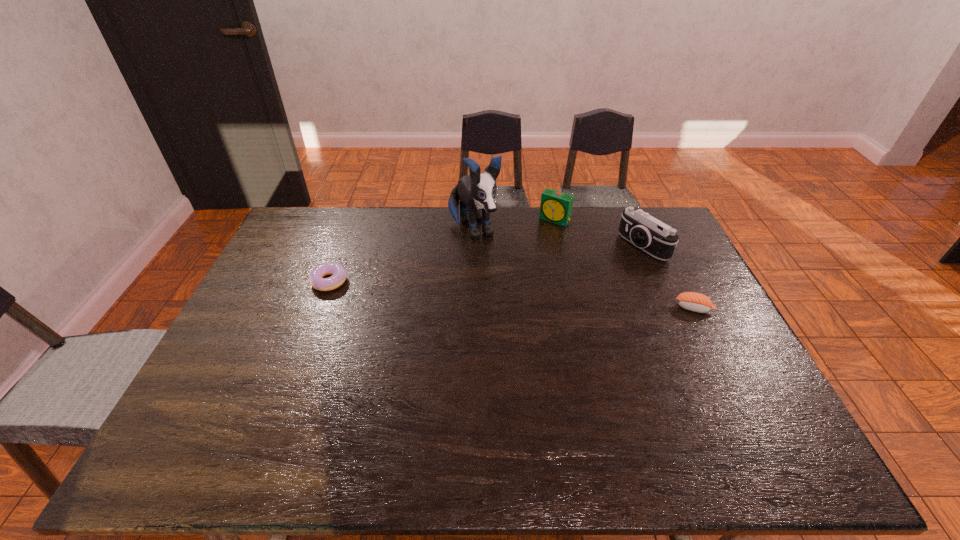
Locate an element on the screen. Image resolution: width=960 pixels, height=540 pixels. vacant space situated on the left of the sushi is located at coordinates (571, 308).

The image size is (960, 540). Find the location of `free space located on the front-facing side of the puppy`. free space located on the front-facing side of the puppy is located at coordinates (521, 323).

Locate an element on the screen. This screenshot has width=960, height=540. free space located 0.070m on the front-facing side of the puppy is located at coordinates (489, 265).

Image resolution: width=960 pixels, height=540 pixels. I want to click on free space located on the front-facing side of the puppy, so click(502, 289).

Locate an element on the screen. vacant area situated on the front lens of the camera is located at coordinates (592, 277).

Locate an element on the screen. This screenshot has height=540, width=960. vacant space situated on the front lens of the camera is located at coordinates (563, 293).

The height and width of the screenshot is (540, 960). What are the coordinates of `vacant position located 0.270m on the front lens of the camera` in the screenshot? It's located at (571, 288).

Locate an element on the screen. free region located on the front-facing side of the third object from left to right is located at coordinates (504, 279).

This screenshot has width=960, height=540. I want to click on vacant space situated on the front-facing side of the third object from left to right, so click(x=519, y=260).

I want to click on vacant space situated 0.390m on the front-facing side of the third object from left to right, so click(x=496, y=288).